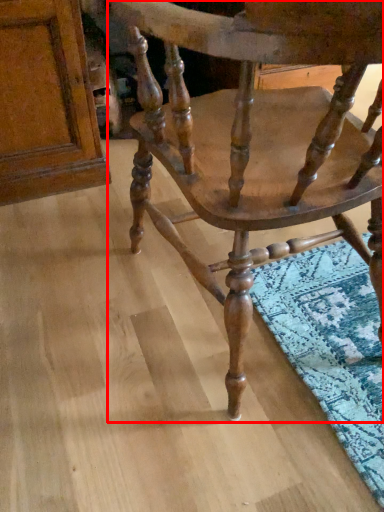
Question: From the image, what is the correct spatial relationship of chair (annotated by the red box) in relation to plank?

Choices:
 (A) left
 (B) right

Answer: (B)